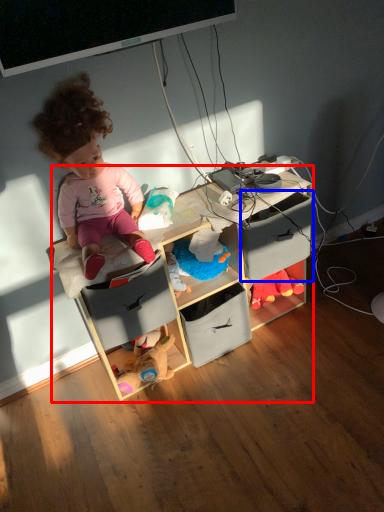
Question: Which object is further to the camera taking this photo, shelf (highlighted by a red box) or drawer (highlighted by a blue box)?

Choices:
 (A) shelf
 (B) drawer

Answer: (B)